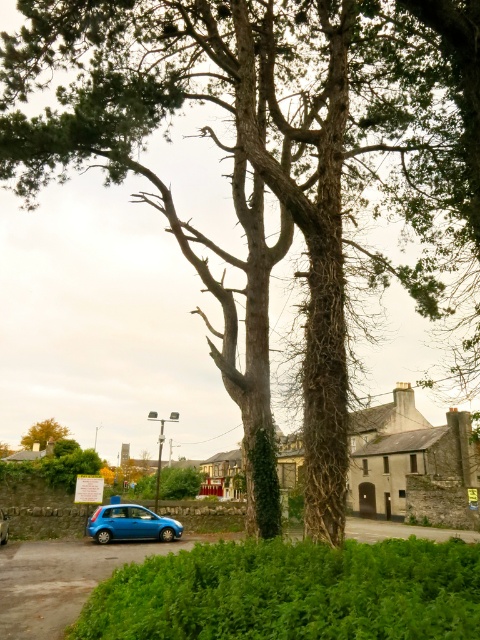
Which is more to the right, green leafy hedge at lower center or brown rough tree at lower left?

green leafy hedge at lower center

Between green leafy hedge at lower center and brown rough tree at lower left, which one appears on the left side from the viewer's perspective?

brown rough tree at lower left

I want to click on green leafy hedge at lower center, so click(291, 593).

At what (x,y) coordinates should I click in order to perform the action: click on green leafy hedge at lower center. Please return your answer as a coordinate pair (x, y). Looking at the image, I should click on (291, 593).

Which is above, green leafy hedge at lower center or blue matte car at lower left?

Positioned higher is green leafy hedge at lower center.

Where is `green leafy hedge at lower center`? This screenshot has width=480, height=640. green leafy hedge at lower center is located at coordinates (291, 593).

Can you confirm if metallic blue hatchback at lower left is positioned to the left of blue matte car at lower left?

Incorrect, metallic blue hatchback at lower left is not on the left side of blue matte car at lower left.

Can you confirm if metallic blue hatchback at lower left is positioned to the right of blue matte car at lower left?

Yes, metallic blue hatchback at lower left is to the right of blue matte car at lower left.

Does point (171, 540) lie in front of point (0, 524)?

No, (171, 540) is behind (0, 524).

Identify the location of metallic blue hatchback at lower left. Image resolution: width=480 pixels, height=640 pixels. (131, 524).